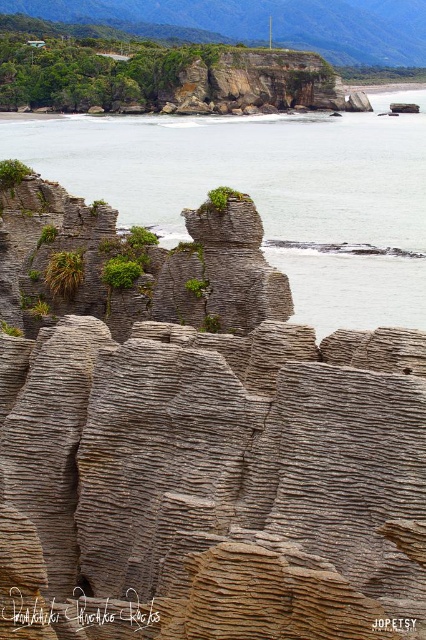
Who is positioned more to the right, brown textured rock formation at center or green leafy shrub at left?

brown textured rock formation at center

Find the location of `brown textured rock formation at center`. brown textured rock formation at center is located at coordinates (198, 442).

Does gray/rocky water at center have a lesser height compared to green leafy shrub at left?

No.

Between gray/rocky water at center and green leafy shrub at left, which one appears on the right side from the viewer's perspective?

From the viewer's perspective, gray/rocky water at center appears more on the right side.

At what (x,y) coordinates should I click in order to perform the action: click on gray/rocky water at center. Please return your answer as a coordinate pair (x, y). Looking at the image, I should click on (267, 193).

Does gray/rocky water at center have a greater height compared to green leafy plant at center?

Correct, gray/rocky water at center is much taller as green leafy plant at center.

Locate an element on the screen. This screenshot has height=640, width=426. gray/rocky water at center is located at coordinates (267, 193).